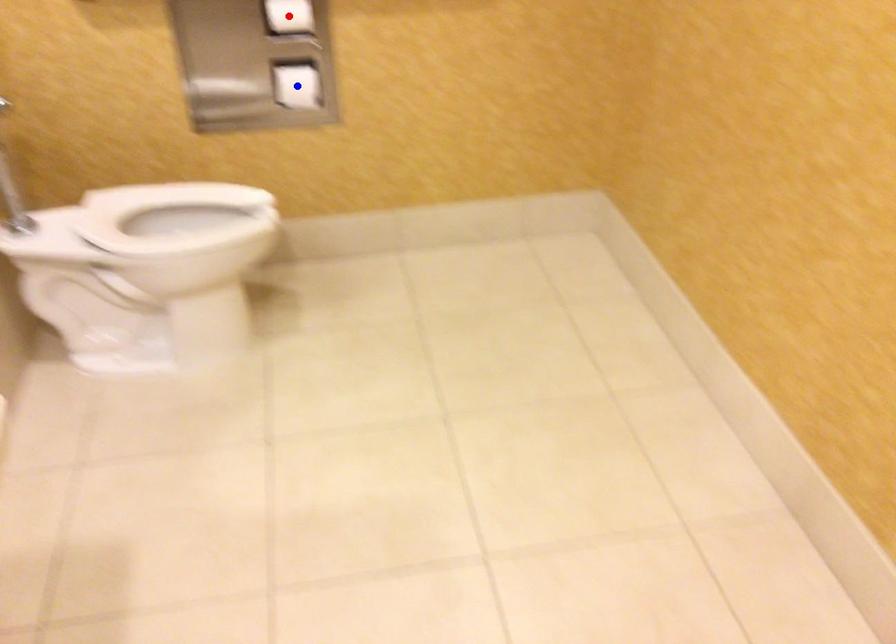
Question: Two points are marked on the image. Which point is closer to the camera?

Choices:
 (A) Blue point is closer.
 (B) Red point is closer.

Answer: (B)